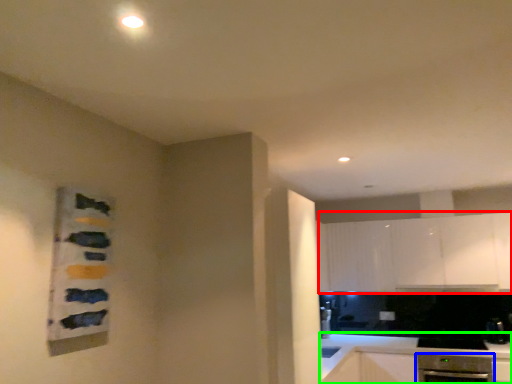
Question: Based on their relative distances, which object is nearer to cabinetry (highlighted by a red box)? Choose from dish washer (highlighted by a blue box) and countertop (highlighted by a green box).

Choices:
 (A) dish washer
 (B) countertop

Answer: (B)